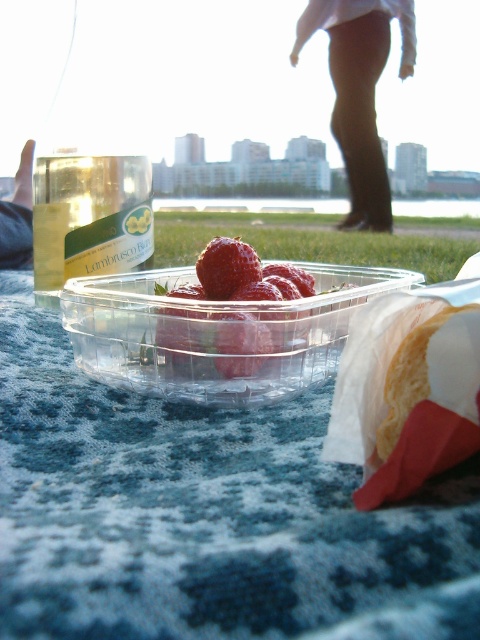
Question: Which of the following is the closest to the observer?

Choices:
 (A) blue knitted tablecloth at center
 (B) skinny jeans at lower left
 (C) black fabric pants at upper center

Answer: (A)

Question: Observing the image, what is the correct spatial positioning of blue knitted tablecloth at center in reference to red matte strawberry at center?

Choices:
 (A) above
 (B) below

Answer: (B)

Question: Does shiny red strawberries at center appear on the right side of red matte strawberry at center?

Choices:
 (A) no
 (B) yes

Answer: (B)

Question: Based on their relative distances, which object is nearer to the black fabric pants at upper center?

Choices:
 (A) blue knitted tablecloth at center
 (B) skinny jeans at lower left

Answer: (B)

Question: Is red matte strawberry at center in front of skinny jeans at lower left?

Choices:
 (A) no
 (B) yes

Answer: (B)

Question: Which of the following is the farthest from the observer?

Choices:
 (A) (229, 291)
 (B) (348, 118)
 (C) (10, 227)
 (D) (142, 435)

Answer: (B)